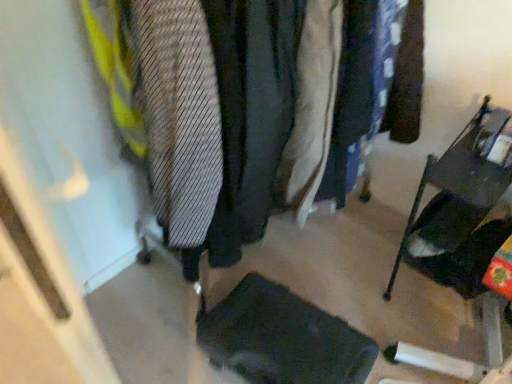
Question: Is black fabric footrest at lower center spatially inside metallic dark gray folding chair at right, or outside of it?

Choices:
 (A) outside
 (B) inside

Answer: (A)

Question: From the image's perspective, is black fabric footrest at lower center above or below metallic dark gray folding chair at right?

Choices:
 (A) above
 (B) below

Answer: (B)

Question: Estimate the real-world distances between objects in this image. Which object is closer to the light beige fabric coat at center?

Choices:
 (A) striped fabric tie at left
 (B) black fabric footrest at lower center
 (C) metallic dark gray folding chair at right

Answer: (A)

Question: Which of these objects is positioned farthest from the black fabric footrest at lower center?

Choices:
 (A) light beige fabric coat at center
 (B) striped fabric tie at left
 (C) metallic dark gray folding chair at right

Answer: (B)